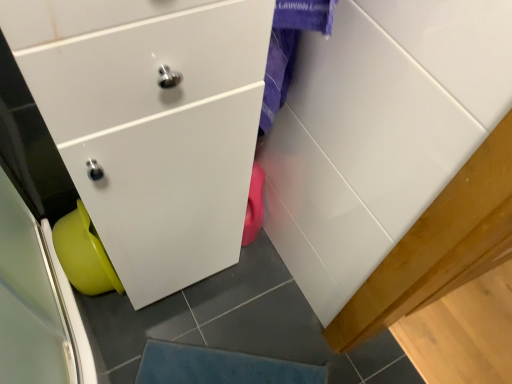
Image resolution: width=512 pixels, height=384 pixels. Describe the element at coordinates (84, 254) in the screenshot. I see `matte yellow toilet bowl at lower left` at that location.

At what (x,y) coordinates should I click in order to perform the action: click on matte yellow toilet bowl at lower left. Please return your answer as a coordinate pair (x, y). The height and width of the screenshot is (384, 512). Looking at the image, I should click on (84, 254).

Consider the image. What is the approximate width of matte yellow toilet bowl at lower left?

matte yellow toilet bowl at lower left is 8.12 inches in width.

Measure the distance between point (116,284) and camera.

Point (116,284) and camera are 3.44 feet apart from each other.

Find the location of `matte yellow toilet bowl at lower left`. matte yellow toilet bowl at lower left is located at coordinates (84, 254).